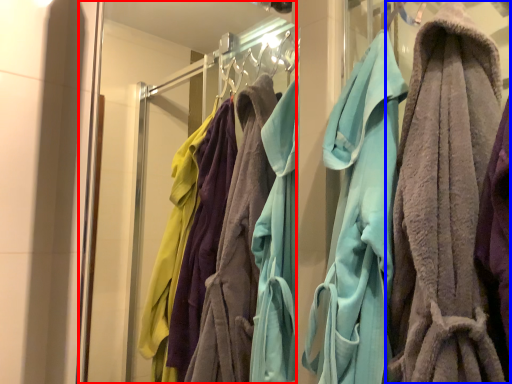
Question: Which point is further to the camera, glass door (highlighted by a red box) or towel (highlighted by a blue box)?

Choices:
 (A) glass door
 (B) towel

Answer: (A)